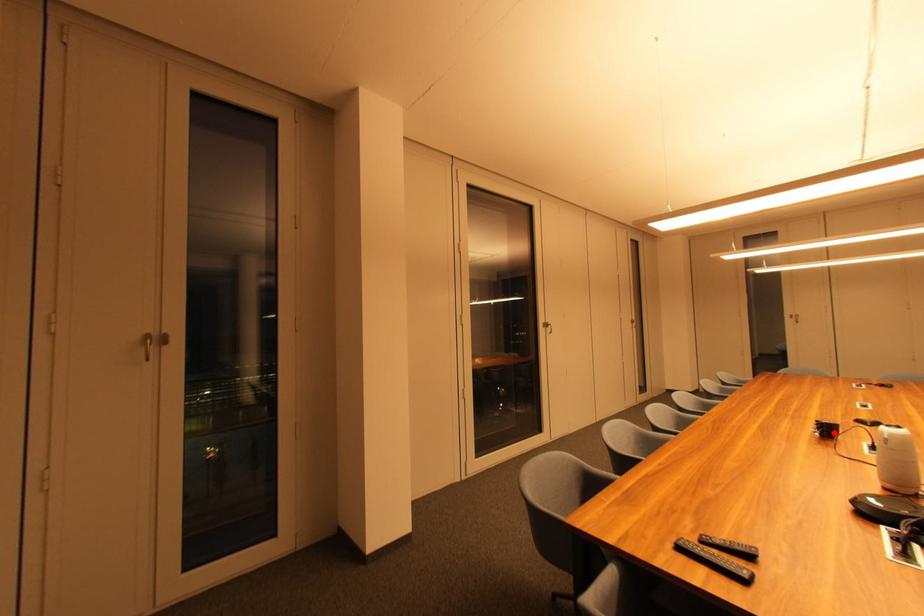
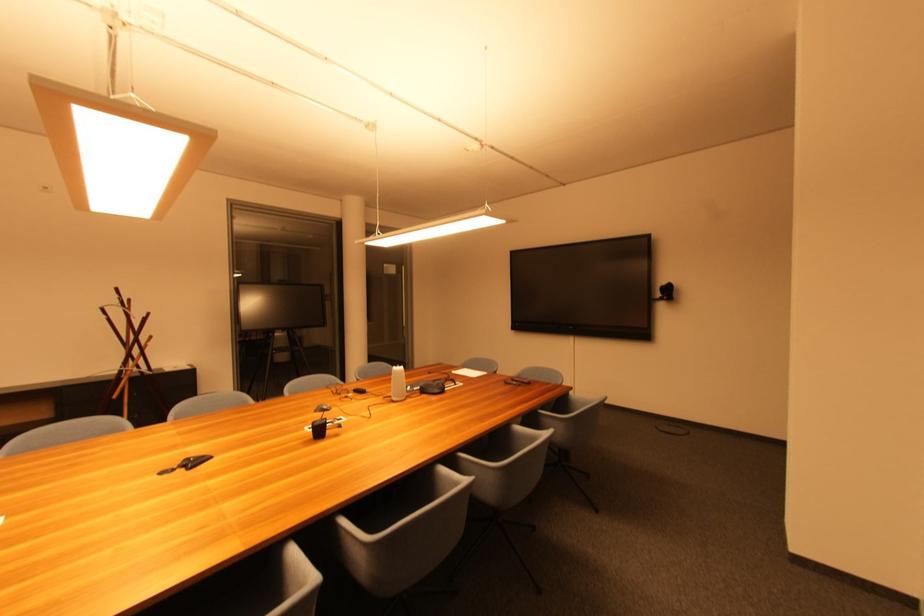
Find the pixel in the second image that matches the highlighted location in the first image.

(324, 432)